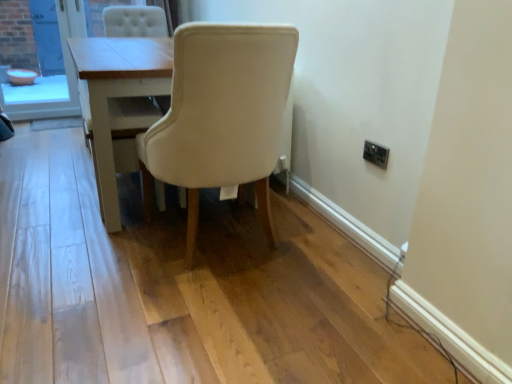
Question: Does beige fabric chair at center contain orange plastic bowl at left?

Choices:
 (A) no
 (B) yes

Answer: (A)

Question: Is beige fabric chair at center positioned before orange plastic bowl at left?

Choices:
 (A) no
 (B) yes

Answer: (B)

Question: Is beige fabric chair at center located outside orange plastic bowl at left?

Choices:
 (A) yes
 (B) no

Answer: (A)

Question: Is there a large distance between beige fabric chair at center and orange plastic bowl at left?

Choices:
 (A) no
 (B) yes

Answer: (B)

Question: Considering the relative sizes of beige fabric chair at center and orange plastic bowl at left in the image provided, is beige fabric chair at center smaller than orange plastic bowl at left?

Choices:
 (A) yes
 (B) no

Answer: (B)

Question: Is beige fabric chair at center positioned behind orange plastic bowl at left?

Choices:
 (A) yes
 (B) no

Answer: (B)

Question: Is black plastic electric outlet at upper right next to orange plastic bowl at left?

Choices:
 (A) yes
 (B) no

Answer: (B)

Question: Is black plastic electric outlet at upper right smaller than orange plastic bowl at left?

Choices:
 (A) yes
 (B) no

Answer: (A)

Question: Does black plastic electric outlet at upper right have a lesser height compared to orange plastic bowl at left?

Choices:
 (A) no
 (B) yes

Answer: (B)

Question: Is black plastic electric outlet at upper right at the right side of orange plastic bowl at left?

Choices:
 (A) no
 (B) yes

Answer: (B)

Question: Is black plastic electric outlet at upper right behind orange plastic bowl at left?

Choices:
 (A) no
 (B) yes

Answer: (A)

Question: Is orange plastic bowl at left inside black plastic electric outlet at upper right?

Choices:
 (A) yes
 (B) no

Answer: (B)

Question: Is light wood table at center oriented away from beige fabric chair at center?

Choices:
 (A) yes
 (B) no

Answer: (B)